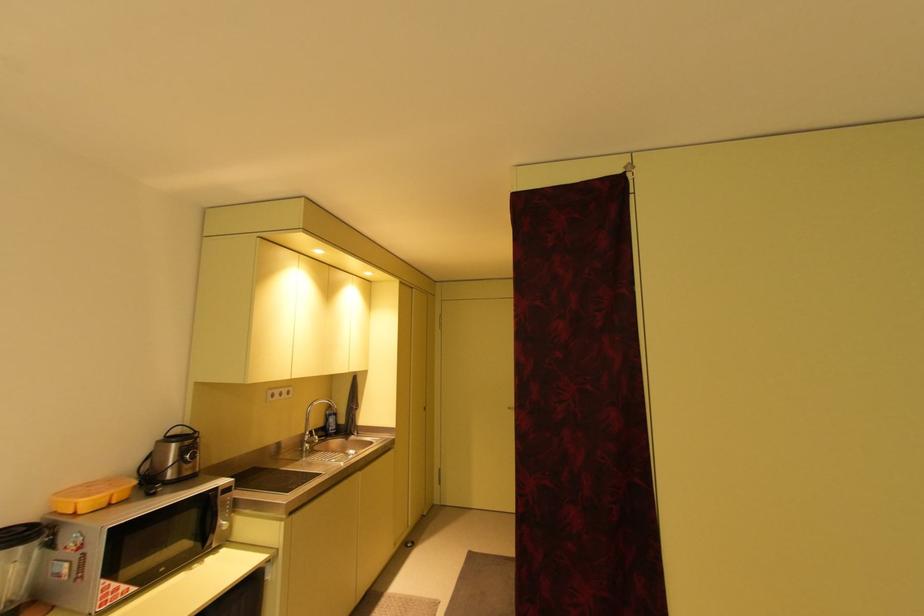
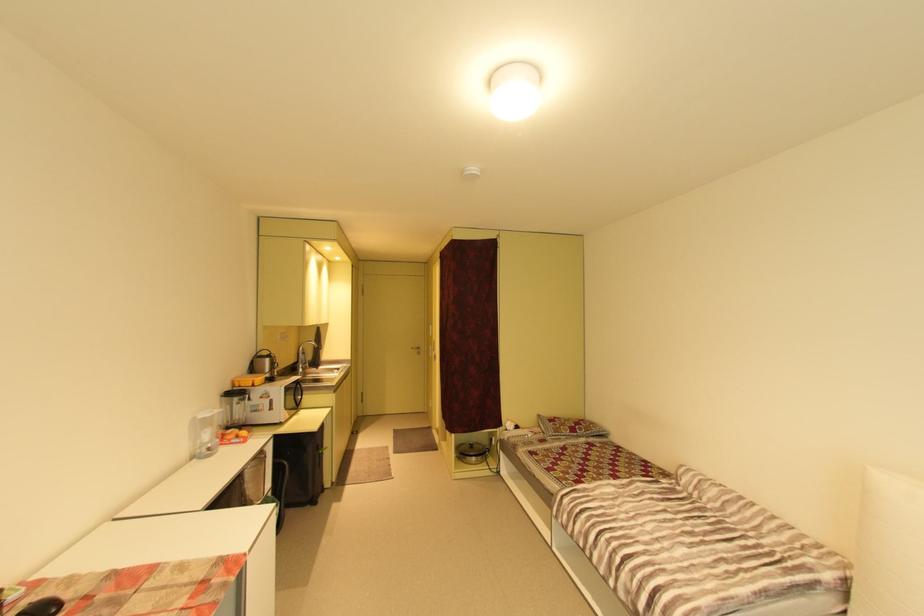
In the second image, find the point that corresponds to point 348,421 in the first image.

(317, 358)